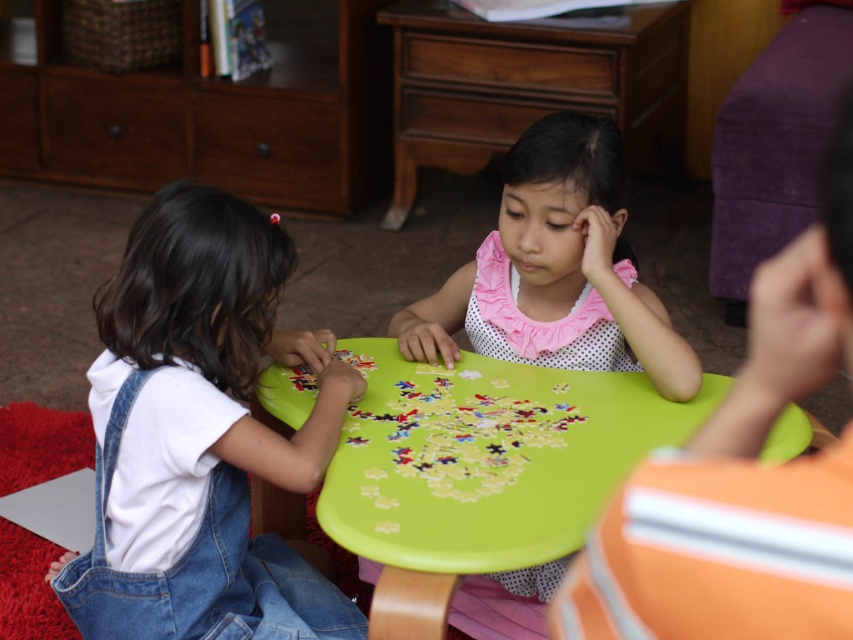
Which is in front, point (263, 563) or point (625, 316)?

Positioned in front is point (625, 316).

Locate an element on the screen. white denim overalls at left is located at coordinates (200, 435).

Find the location of a particular element. The image size is (853, 640). white denim overalls at left is located at coordinates (200, 435).

Who is taller, white denim overalls at left or green plastic table at center?

white denim overalls at left is taller.

What do you see at coordinates (200, 435) in the screenshot? The image size is (853, 640). I see `white denim overalls at left` at bounding box center [200, 435].

Image resolution: width=853 pixels, height=640 pixels. What are the coordinates of `white denim overalls at left` in the screenshot? It's located at (200, 435).

Between point (616, 451) and point (527, 445), which one is positioned behind?

The point (527, 445) is more distant.

Is green plastic table at center wider than green plastic puzzle at center?

Indeed, green plastic table at center has a greater width compared to green plastic puzzle at center.

Locate an element on the screen. The width and height of the screenshot is (853, 640). green plastic table at center is located at coordinates (486, 458).